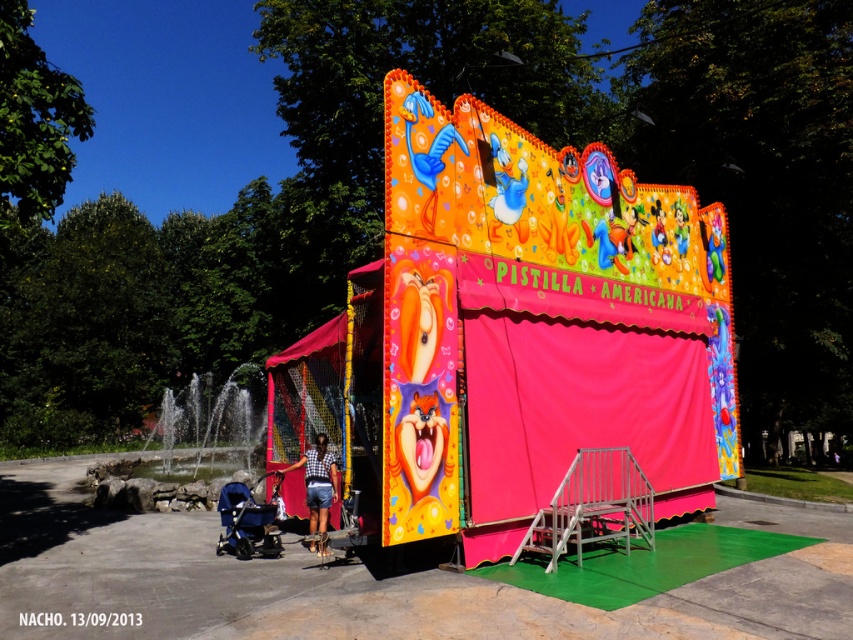
Question: Does matte black stroller at lower left appear on the left side of denim shorts at center?

Choices:
 (A) no
 (B) yes

Answer: (B)

Question: Which object is positioned farthest from the matte black stroller at lower left?

Choices:
 (A) vibrant plastic carnival booth at center
 (B) denim shorts at center

Answer: (A)

Question: Observing the image, what is the correct spatial positioning of matte black stroller at lower left in reference to denim shorts at center?

Choices:
 (A) left
 (B) right

Answer: (A)

Question: Which of the following is the closest to the observer?

Choices:
 (A) vibrant plastic carnival booth at center
 (B) denim shorts at center

Answer: (A)

Question: Among these points, which one is nearest to the camera?

Choices:
 (A) (233, 506)
 (B) (312, 476)
 (C) (399, 243)

Answer: (C)

Question: Can you confirm if vibrant plastic carnival booth at center is bigger than denim shorts at center?

Choices:
 (A) yes
 (B) no

Answer: (B)